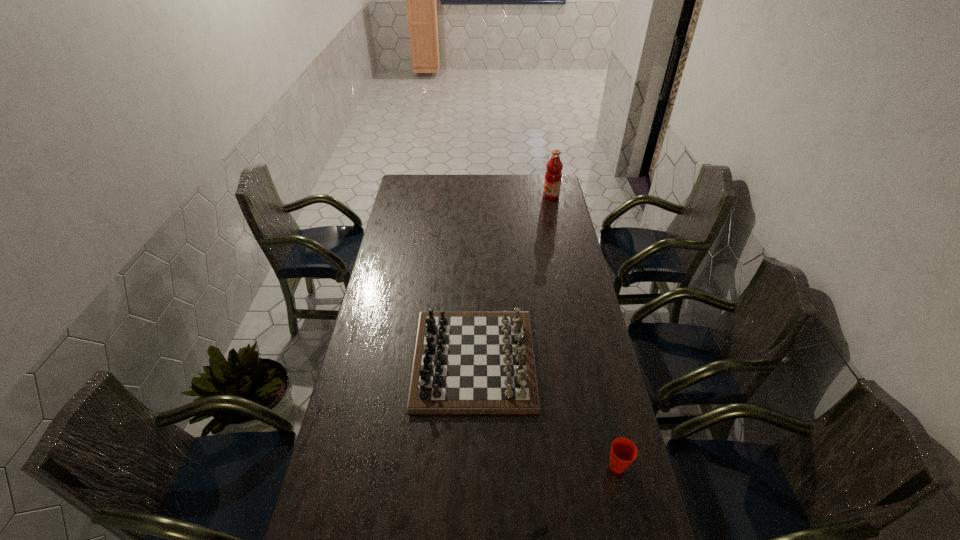
Locate which object ranks second in proximity to the tallest object. Please provide its 2D coordinates. Your answer should be formatted as a tuple, i.e. [(x, y)], where the tuple contains the x and y coordinates of a point satisfying the conditions above.

[(623, 452)]

Identify which object is located as the third nearest to the fruit juice. Please provide its 2D coordinates. Your answer should be formatted as a tuple, i.e. [(x, y)], where the tuple contains the x and y coordinates of a point satisfying the conditions above.

[(539, 531)]

Image resolution: width=960 pixels, height=540 pixels. Identify the location of free location that satisfies the following two spatial constraints: 1. from the player's perspective of the third nearest object; 2. on the left side of the second nearest object. (472, 466).

At what (x,y) coordinates should I click in order to perform the action: click on free region that satisfies the following two spatial constraints: 1. on the front label of the third farthest object; 2. on the left side of the farthest object. Please return your answer as a coordinate pair (x, y). The height and width of the screenshot is (540, 960). Looking at the image, I should click on (612, 466).

Find the location of `vacant space that satisfies the following two spatial constraints: 1. on the front label of the farthest object; 2. on the left side of the second nearest object`. vacant space that satisfies the following two spatial constraints: 1. on the front label of the farthest object; 2. on the left side of the second nearest object is located at coordinates (612, 466).

This screenshot has width=960, height=540. Identify the location of vacant space that satisfies the following two spatial constraints: 1. from the player's perspective of the second nearest object; 2. on the right side of the chessboard. (472, 466).

Locate an element on the screen. This screenshot has height=540, width=960. free region that satisfies the following two spatial constraints: 1. from the player's perspective of the third farthest object; 2. on the right side of the third nearest object is located at coordinates (472, 466).